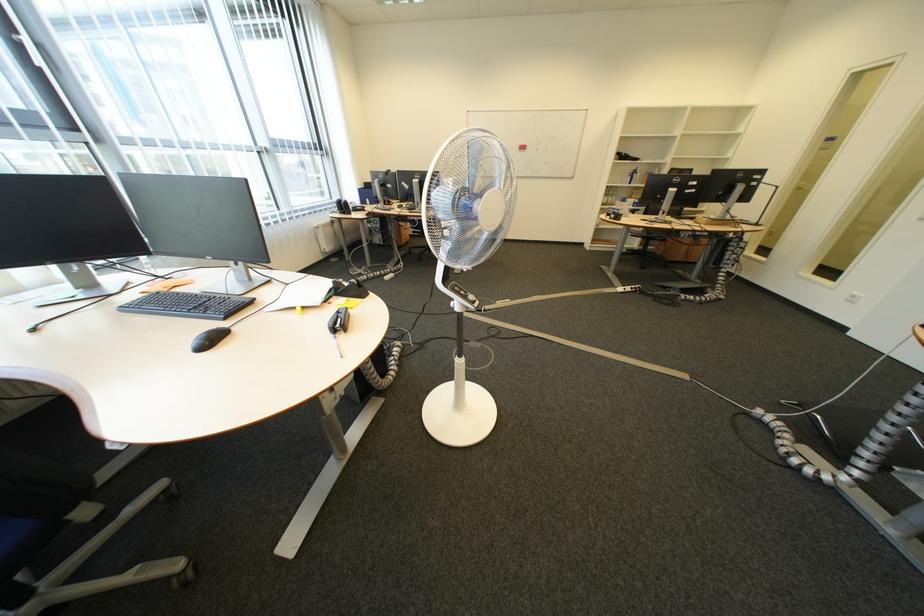
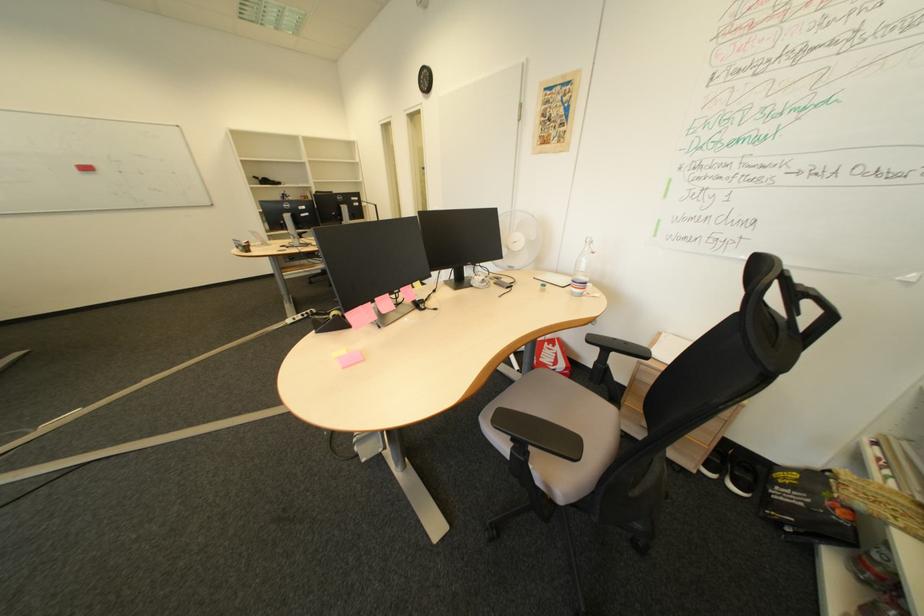
In the second image, find the point that corresponds to the point at 665,222 in the first image.

(301, 246)